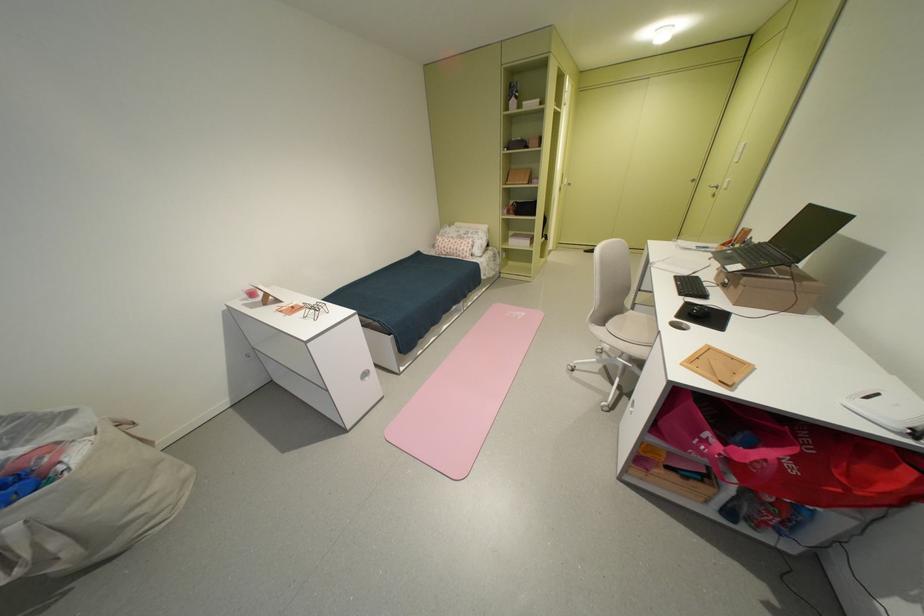
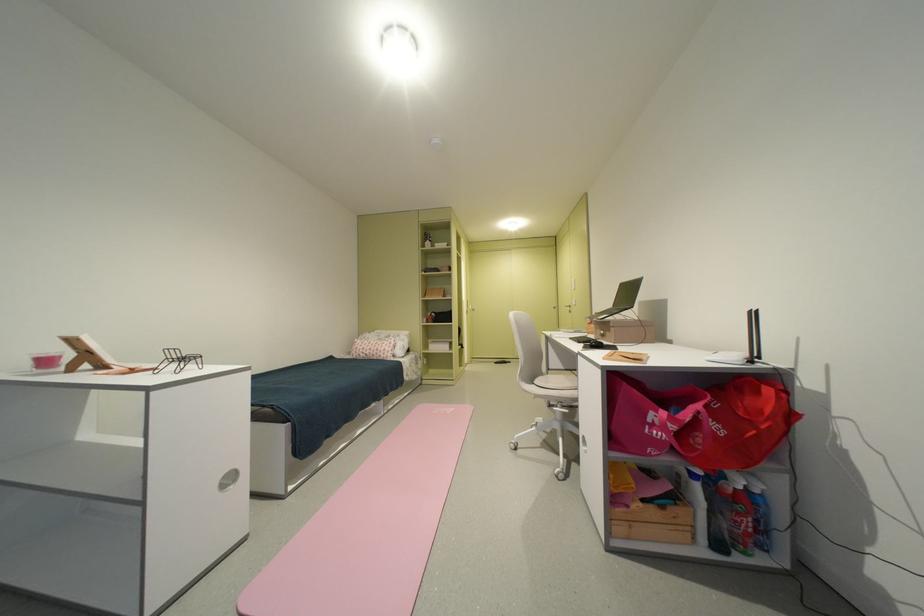
Find the pixel in the second image that matches (x=704, y=310) in the first image.

(602, 342)